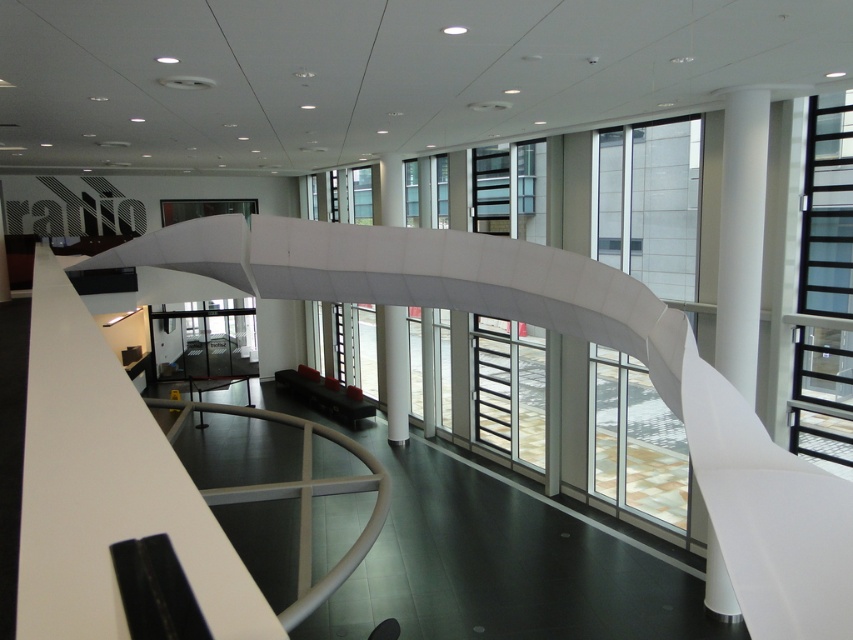
Can you confirm if white smooth column at right is positioned above white glossy pillar at center?

Indeed, white smooth column at right is positioned over white glossy pillar at center.

Consider the image. Which is more to the right, white smooth column at right or white glossy pillar at center?

From the viewer's perspective, white smooth column at right appears more on the right side.

Between point (740, 108) and point (398, 371), which one is positioned behind?

Positioned behind is point (398, 371).

Where is `white smooth column at right`? Image resolution: width=853 pixels, height=640 pixels. white smooth column at right is located at coordinates (741, 237).